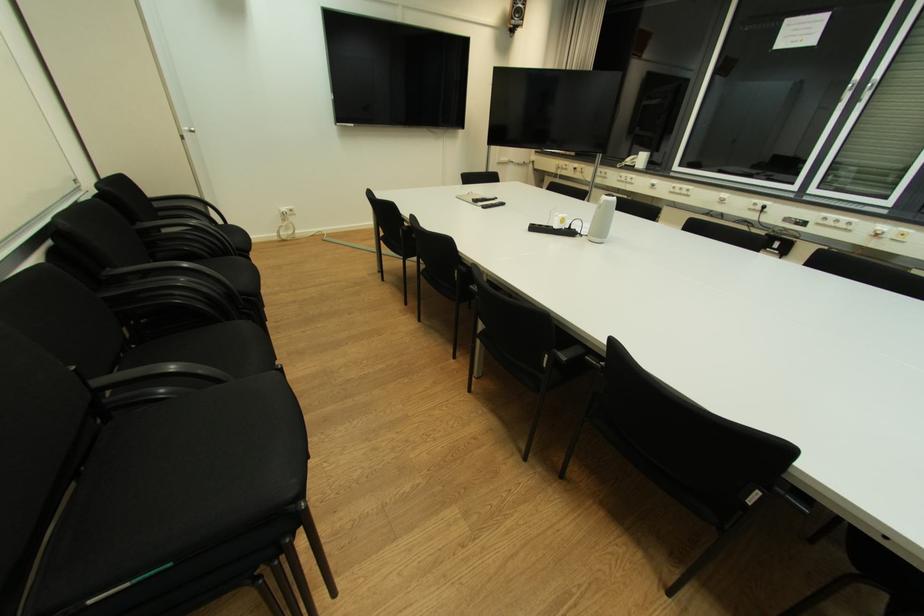
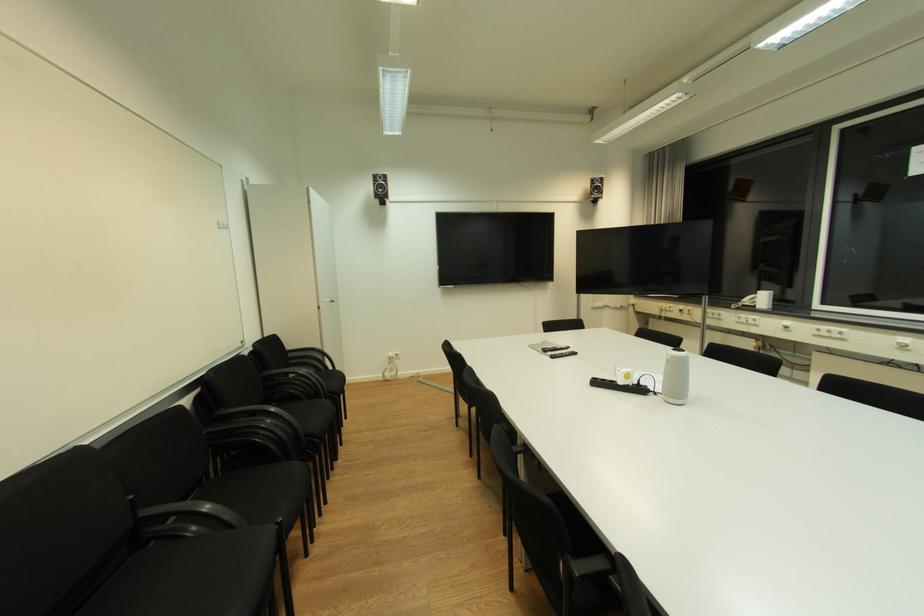
Find the pixel in the second image that matches point 289,209 in the first image.

(396, 355)